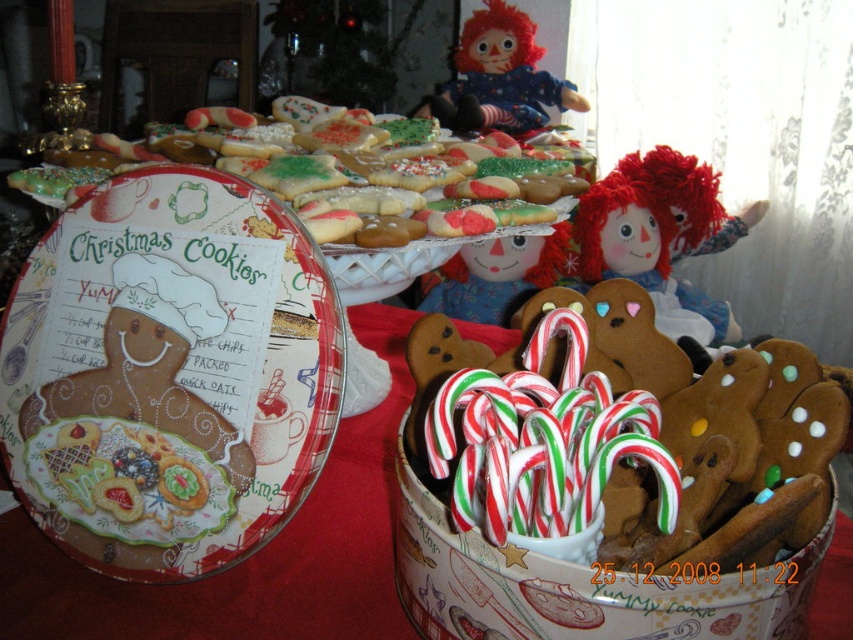
Can you confirm if matte cardboard platter at center is shorter than matte plastic doll at upper center?

Correct, matte cardboard platter at center is not as tall as matte plastic doll at upper center.

Is matte cardboard platter at center closer to the viewer compared to matte plastic doll at upper center?

Yes, it is in front of matte plastic doll at upper center.

I want to click on matte cardboard platter at center, so click(169, 372).

Where is `matte cardboard platter at center`? The image size is (853, 640). matte cardboard platter at center is located at coordinates (169, 372).

Who is higher up, matte cardboard platter at center or glazed sugar cookies at upper center?

glazed sugar cookies at upper center

This screenshot has width=853, height=640. What do you see at coordinates (169, 372) in the screenshot?
I see `matte cardboard platter at center` at bounding box center [169, 372].

Which is behind, point (135, 547) or point (378, 157)?

Positioned behind is point (378, 157).

The width and height of the screenshot is (853, 640). I want to click on matte cardboard platter at center, so click(x=169, y=372).

Between fluffy red-haired doll at center and matte plastic doll at upper center, which one appears on the right side from the viewer's perspective?

fluffy red-haired doll at center

Does fluffy red-haired doll at center come in front of matte plastic doll at upper center?

Yes, it is in front of matte plastic doll at upper center.

Is point (630, 236) positioned before point (482, 120)?

Yes, point (630, 236) is closer to viewer.

I want to click on fluffy red-haired doll at center, so click(x=660, y=236).